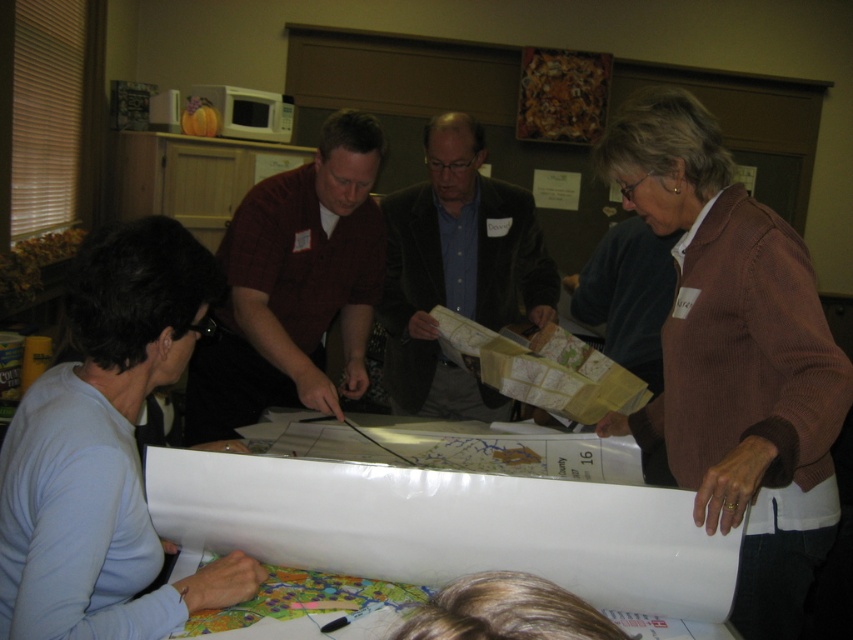
You are a photographer standing at the back of the room. You want to take a photo of the brown corduroy sweater at upper right and the velvet brown jacket at center so that both are clearly visible in the frame. Given their current distance, is it possible to capture both in a single shot without moving either object?

The brown corduroy sweater at upper right is 35.65 inches from the velvet brown jacket at center. Since this distance is manageable within a typical camera frame, yes, both can be captured clearly in a single shot without moving either object.

You are standing at the center of the table and see two points marked on the table surface. The first point is at coordinate point (674, 180) and the second point is at coordinate point (233, 381). Which point is closer to you?

Point (674, 180) is in front of point (233, 381), so the first point is closer to you.

You are a photographer standing to the left of the velvet brown jacket at center. You want to take a photo of the brown corduroy sweater at upper right without moving. Which direction should you move your camera to capture it?

The brown corduroy sweater at upper right is to the right of the velvet brown jacket at center, so you should move your camera to the right to capture it.